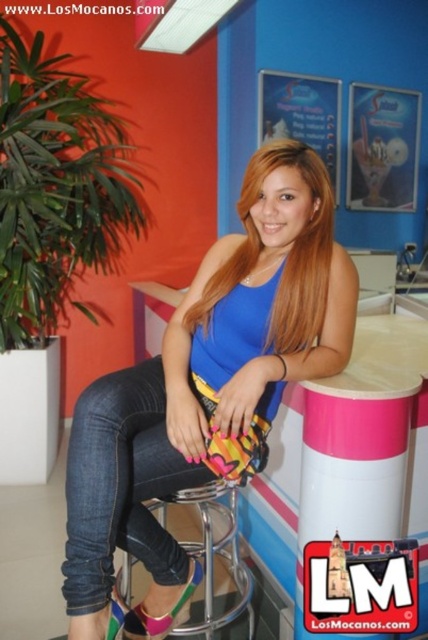
Is blue matte tank top at center closer to camera compared to pink fabric sandal at lower center?

Yes, blue matte tank top at center is closer to the viewer.

Is point (100, 509) positioned before point (124, 620)?

Yes, point (100, 509) is closer to viewer.

You are a GUI agent. You are given a task and a screenshot of the screen. Output one action in this format:
    pyautogui.click(x=<x>, y=<y>)
    Task: Click on the blue matte tank top at center
    This screenshot has width=428, height=640.
    Given the screenshot: What is the action you would take?
    pyautogui.click(x=208, y=371)

Which of these two, blonde silky hair at center or pink fabric sandal at lower center, stands taller?

blonde silky hair at center is taller.

From the picture: Does blonde silky hair at center have a greater height compared to pink fabric sandal at lower center?

Correct, blonde silky hair at center is much taller as pink fabric sandal at lower center.

Is point (309, 272) closer to camera compared to point (181, 616)?

Yes, point (309, 272) is closer to viewer.

Image resolution: width=428 pixels, height=640 pixels. Identify the location of blonde silky hair at center. (287, 256).

Is jeans at center positioned in front of pink fabric sandal at lower left?

Yes, jeans at center is closer to the viewer.

Locate an element on the screen. jeans at center is located at coordinates (121, 484).

The height and width of the screenshot is (640, 428). What do you see at coordinates (121, 484) in the screenshot?
I see `jeans at center` at bounding box center [121, 484].

Identify the location of jeans at center. (121, 484).